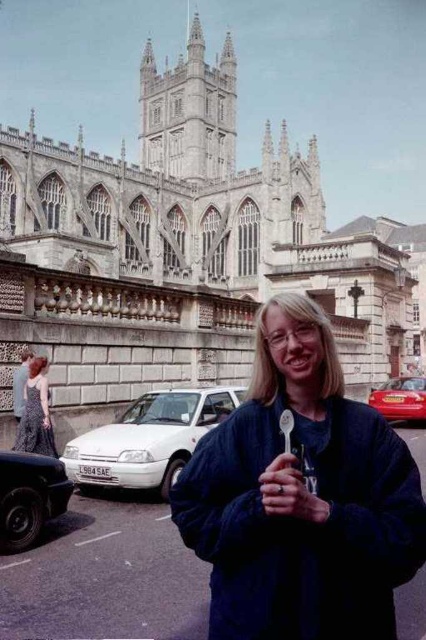
Question: Can you confirm if gray stone church at upper center is positioned below white matte car at lower left?

Choices:
 (A) no
 (B) yes

Answer: (A)

Question: Which object appears closest to the camera in this image?

Choices:
 (A) shiny red car at center right
 (B) black rubber tire at lower left

Answer: (B)

Question: Which of the following is the closest to the observer?

Choices:
 (A) (75, 451)
 (B) (302, 484)
 (C) (46, 426)

Answer: (B)

Question: Is the position of patterned fabric dress at left less distant than that of shiny red car at center right?

Choices:
 (A) no
 (B) yes

Answer: (B)

Question: Which point is farther to the camera?

Choices:
 (A) 402,378
 (B) 11,538
 (C) 25,429

Answer: (A)

Question: Can you confirm if gray stone church at upper center is positioned to the left of matte plastic spoon at center?

Choices:
 (A) no
 (B) yes

Answer: (B)